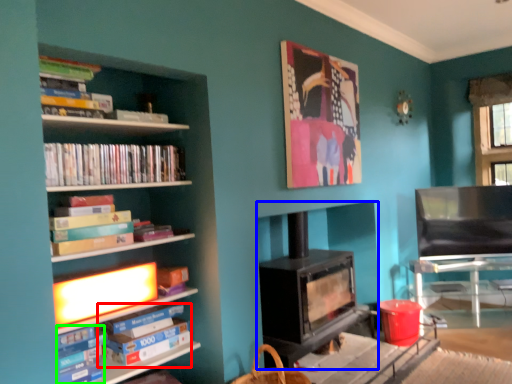
Question: Based on their relative distances, which object is nearer to paperback book (highlighted by a red box)? Choose from wood burning stove (highlighted by a blue box) and book (highlighted by a green box).

Choices:
 (A) wood burning stove
 (B) book

Answer: (B)